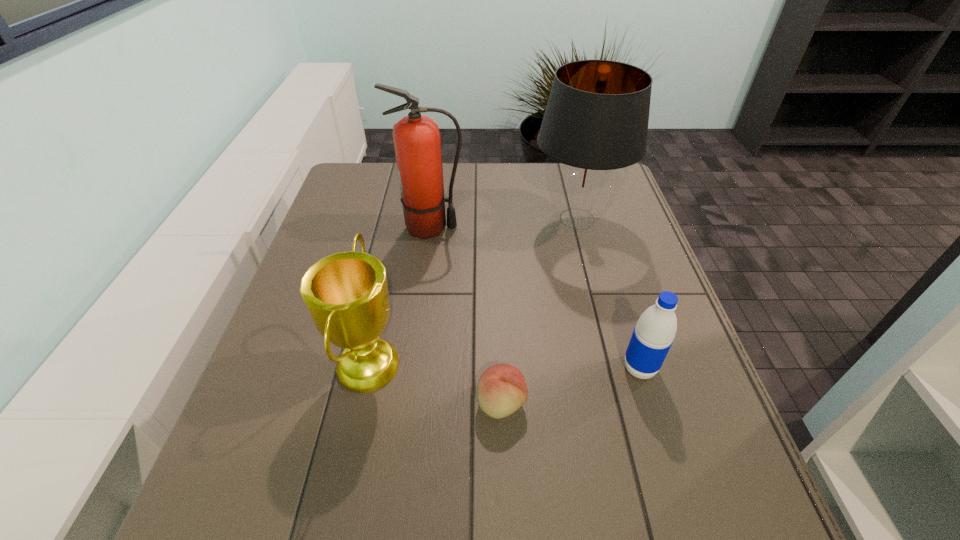
Identify the location of vacant space located 0.110m on the left of the shortest object. The width and height of the screenshot is (960, 540). (420, 403).

Locate an element on the screen. object present at the far edge is located at coordinates (595, 125).

The width and height of the screenshot is (960, 540). I want to click on object that is at the left edge, so click(346, 294).

Locate an element on the screen. This screenshot has width=960, height=540. lampshade present at the right edge is located at coordinates (595, 125).

This screenshot has height=540, width=960. In order to click on water bottle that is at the right edge in this screenshot , I will do `click(653, 335)`.

The height and width of the screenshot is (540, 960). In order to click on object present at the far right corner in this screenshot , I will do `click(595, 125)`.

Locate an element on the screen. vacant region at the far edge of the desktop is located at coordinates (445, 166).

The height and width of the screenshot is (540, 960). In order to click on vacant region at the near edge of the desktop in this screenshot , I will do `click(613, 496)`.

Image resolution: width=960 pixels, height=540 pixels. In the image, there is a desktop. Identify the location of free region at the left edge. (314, 242).

In the image, there is a desktop. In order to click on vacant space at the right edge in this screenshot , I will do `click(622, 206)`.